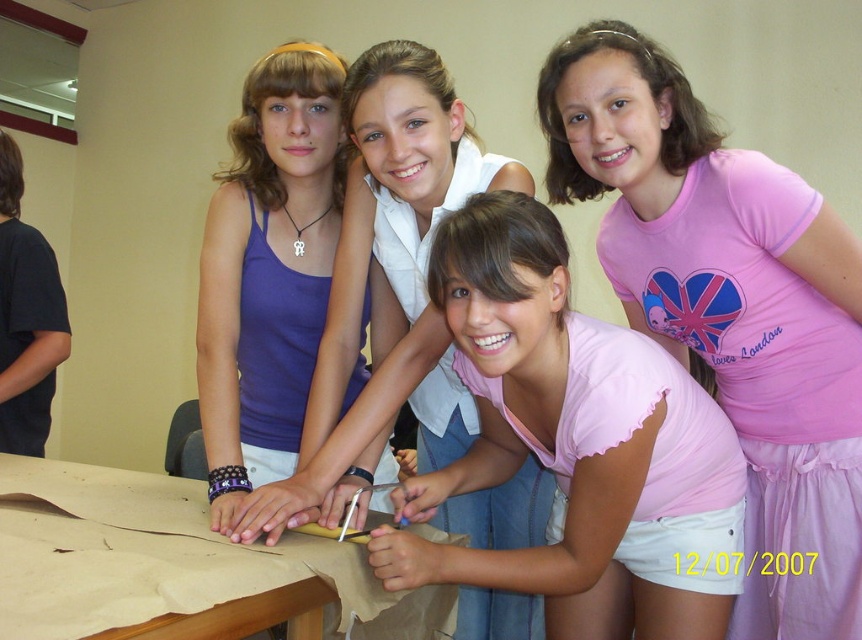
Question: Which point is farther from the camera taking this photo?

Choices:
 (A) (386, 259)
 (B) (222, 403)

Answer: (A)

Question: Among these objects, which one is farthest from the camera?

Choices:
 (A) brown wooden table at center
 (B) pink cotton shirt at center
 (C) pink fabric shirt at upper right

Answer: (C)

Question: Can you confirm if matte blue tank top at upper left is positioned to the left of matte purple tank top at upper left?

Choices:
 (A) yes
 (B) no

Answer: (B)

Question: Is pink fabric shirt at upper right in front of pink cotton shirt at center?

Choices:
 (A) no
 (B) yes

Answer: (A)

Question: Is pink cotton shirt at center above brown wooden table at center?

Choices:
 (A) yes
 (B) no

Answer: (A)

Question: Which point is farther to the camera?

Choices:
 (A) (508, 609)
 (B) (551, 461)

Answer: (A)